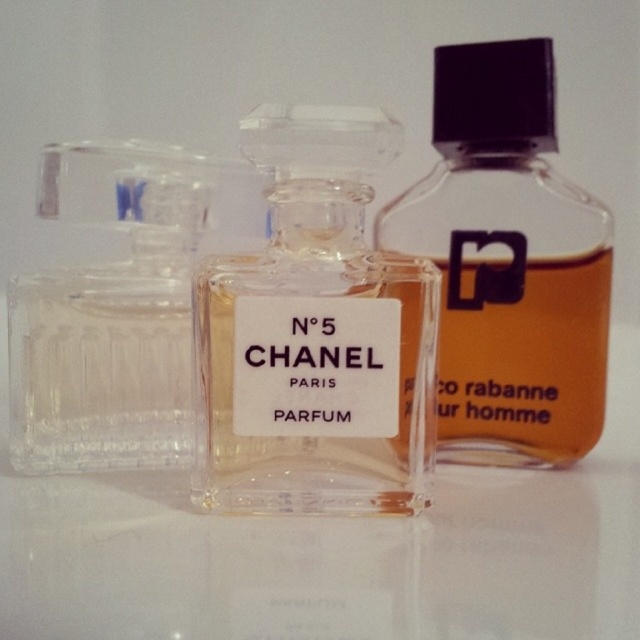
Question: Is clear glass bottle at center wider than transparent glass perfume at left?

Choices:
 (A) no
 (B) yes

Answer: (B)

Question: Which object is positioned closest to the clear glass bottle at center?

Choices:
 (A) transparent glass perfume at left
 (B) transparent glass bottle at center

Answer: (B)

Question: Which point appears closest to the camera in this image?

Choices:
 (A) (412, 208)
 (B) (264, 262)
 (C) (88, 340)

Answer: (B)

Question: Does clear glass bottle at center come in front of transparent glass bottle at center?

Choices:
 (A) yes
 (B) no

Answer: (A)

Question: Which point is farther to the camera?

Choices:
 (A) (538, 97)
 (B) (100, 326)

Answer: (A)

Question: Can you confirm if transparent glass bottle at center is bigger than transparent glass perfume at left?

Choices:
 (A) no
 (B) yes

Answer: (B)